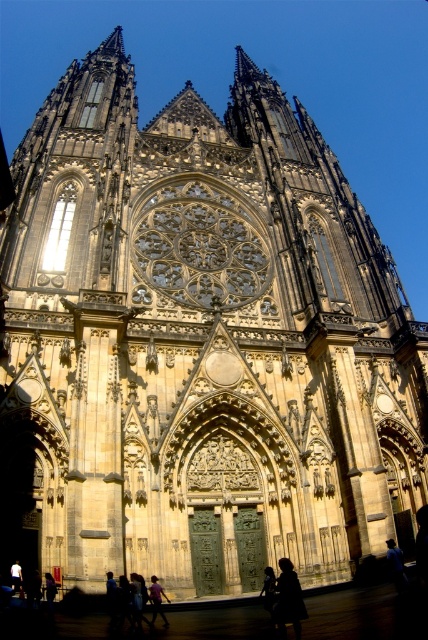
Question: Is dark hair at lower center thinner than dark blue jeans at center?

Choices:
 (A) no
 (B) yes

Answer: (A)

Question: Is dark blue jeans at center smaller than dark brown leather jacket at lower left?

Choices:
 (A) yes
 (B) no

Answer: (A)

Question: Which object appears farthest from the camera in this image?

Choices:
 (A) dark blue jeans at center
 (B) dark brown leather jacket at lower left

Answer: (B)

Question: Is dark blue jeans at center bigger than dark brown leather jacket at lower left?

Choices:
 (A) yes
 (B) no

Answer: (B)

Question: Estimate the real-world distances between objects in this image. Which object is farther from the dark hair at lower center?

Choices:
 (A) dark brown leather jacket at lower left
 (B) dark blue jeans at center

Answer: (A)

Question: Estimate the real-world distances between objects in this image. Which object is closer to the dark hair at lower center?

Choices:
 (A) dark blue jeans at center
 (B) dark brown leather jacket at lower left

Answer: (A)